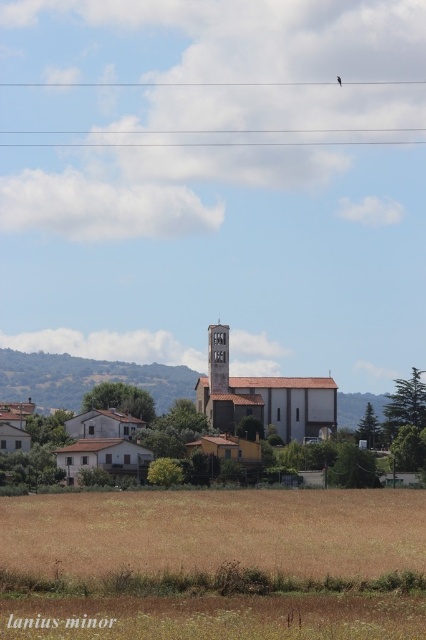
You are standing at point A at point (345,129) and want to walk to point B. The distance between them is 1208.60 feet. If you walk at a speed of 3 feet per second, how many minutes will it take you to reach point B?

The distance between point A at point (345,129) and point B is 1208.60 feet. At a walking speed of 3 feet per second, it would take 1208.60 divided by 3 equals approximately 402.87 seconds. Converting seconds to minutes by dividing by 60 gives about 6.71 minutes. So, it will take approximately 6.7 minutes to reach point B.

Based on the photo, you are a farmer checking the boundaries of your land. You notice the brown grassland at lower center and the clear plastic wire at upper center. Which object is located to the right of the other?

The brown grassland at lower center is positioned on the right side of clear plastic wire at upper center, so the brown grassland at lower center is to the right of the clear plastic wire at upper center.